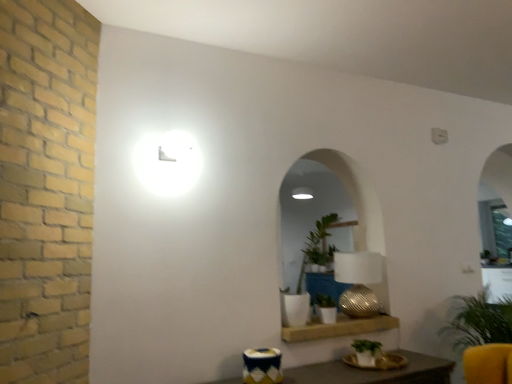
Question: In the image, is green matte plant at center, which appears as the 2th houseplant when viewed from the left, on the left side or the right side of green matte plant at lower center, which appears as the 3th houseplant when viewed from the left?

Choices:
 (A) right
 (B) left

Answer: (B)

Question: Is green matte plant at center, placed as the 3th houseplant when sorted from right to left, in front of or behind green matte plant at lower center, which appears as the 3th houseplant when viewed from the left, in the image?

Choices:
 (A) behind
 (B) front

Answer: (A)

Question: Estimate the real-world distances between objects in this image. Which object is closer to the green leafy plant at right, which appears as the first houseplant when viewed from the right?

Choices:
 (A) white ceramic plant at center, which is the fourth houseplant in right-to-left order
 (B) textured gold table lamp at center
 (C) wooden shelf at lower center
 (D) green matte plant at lower center, which appears as the 3th houseplant when viewed from the left
 (E) green matte plant at center, which appears as the 2th houseplant when viewed from the left

Answer: (B)

Question: Considering the real-world distances, which object is closest to the textured gold table lamp at center?

Choices:
 (A) white ceramic plant at center, the 1th houseplant from the left
 (B) green matte plant at lower center, which appears as the 3th houseplant when viewed from the left
 (C) green leafy plant at right, which appears as the first houseplant when viewed from the right
 (D) wooden shelf at lower center
 (E) green matte plant at center, which appears as the 2th houseplant when viewed from the left

Answer: (D)